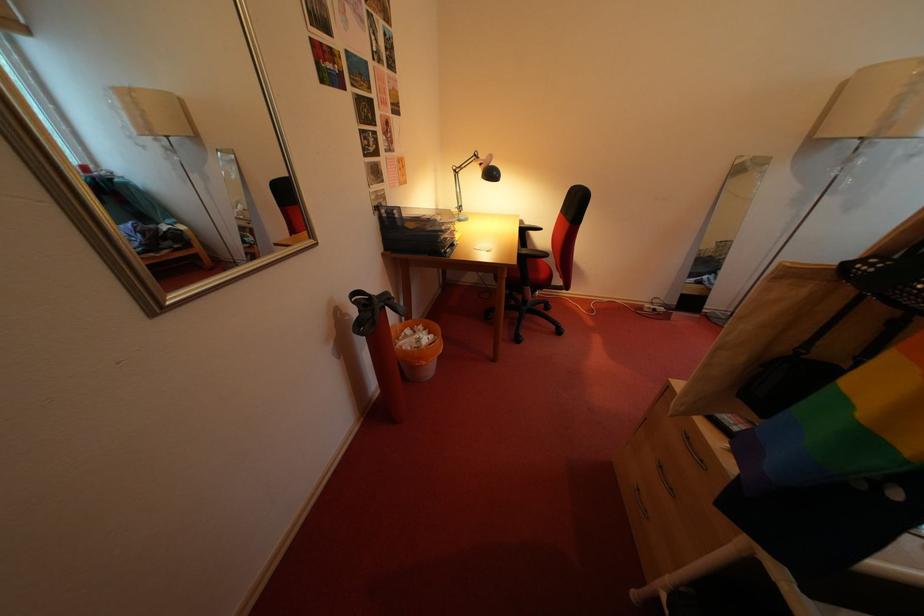
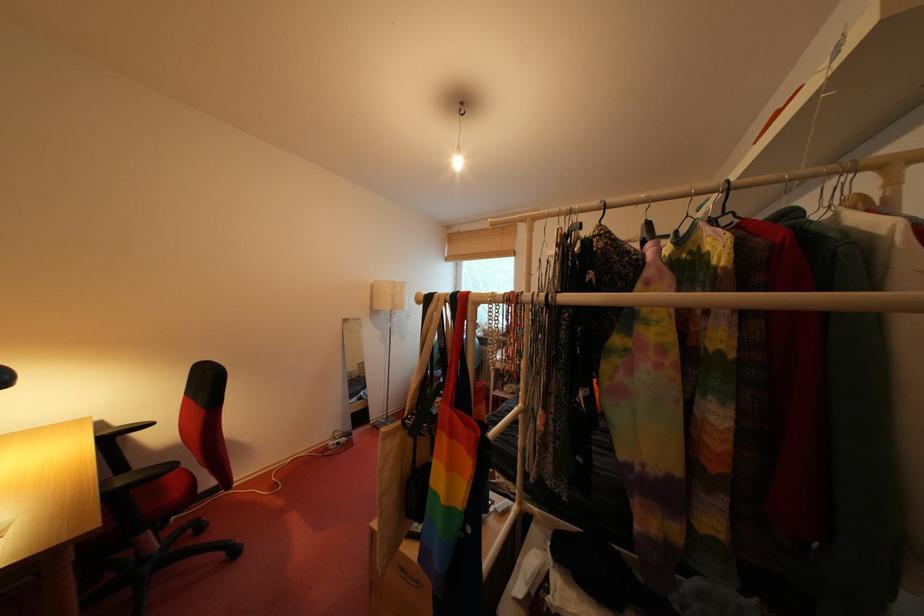
Question: The camera is either moving clockwise (left) or counter-clockwise (right) around the object. The first image is from the beginning of the video and the second image is from the end. Is the camera moving left or right when shooting the video?

Choices:
 (A) Left
 (B) Right

Answer: (A)